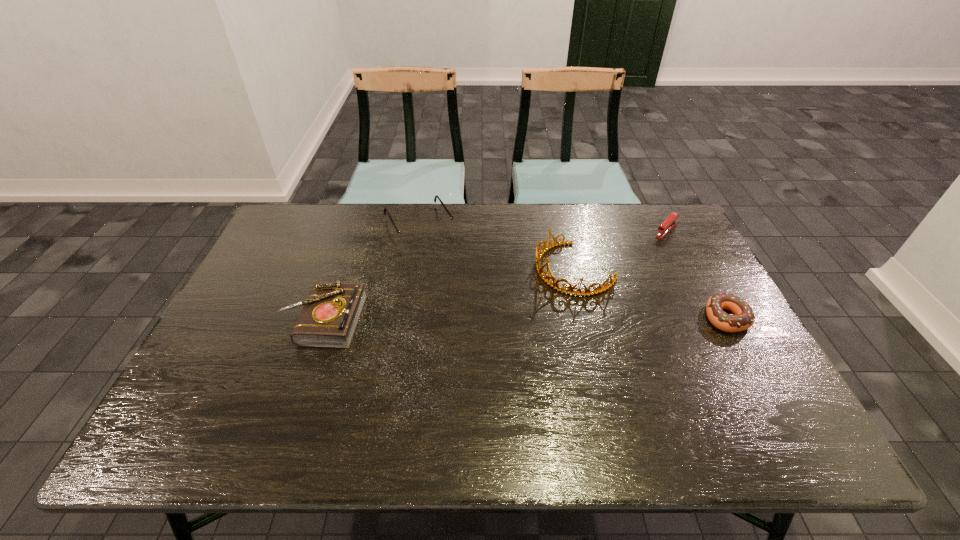
Identify which object is located as the nearest to the spectacles. Please provide its 2D coordinates. Your answer should be formatted as a tuple, i.e. [(x, y)], where the tuple contains the x and y coordinates of a point satisfying the conditions above.

[(329, 318)]

Find the location of a particular element. The image size is (960, 540). vacant space that satisfies the following two spatial constraints: 1. on the front side of the stapler; 2. on the left side of the spectacles is located at coordinates (419, 230).